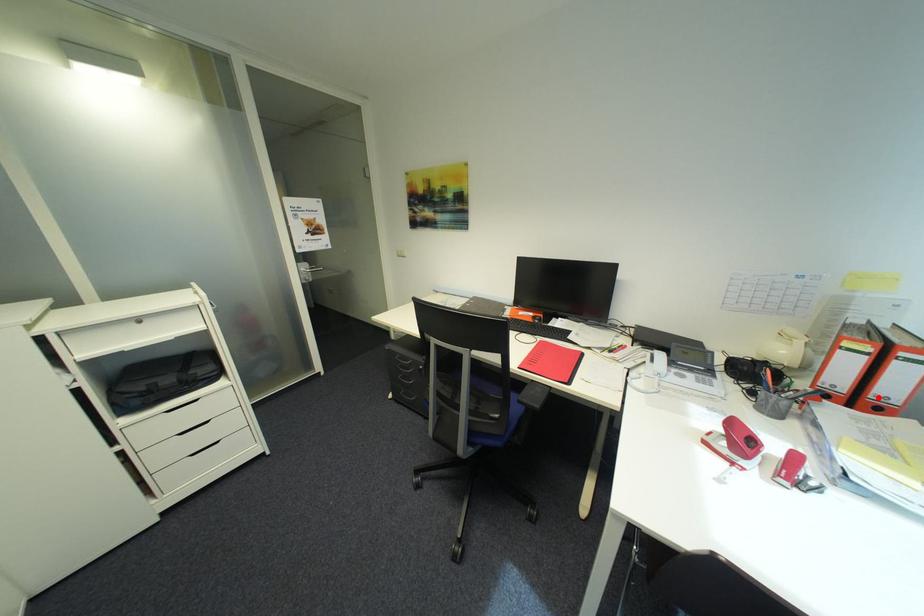
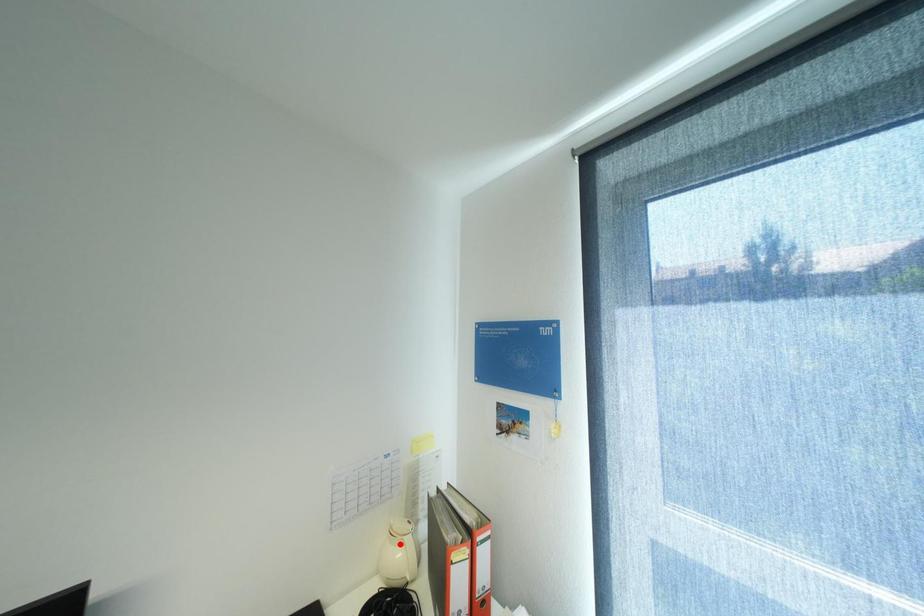
I am providing you with two images of the same scene from different viewpoints. A red point is marked on the first image and another point is marked on the second image. Is the red point in image1 aligned with the point shown in image2?

No